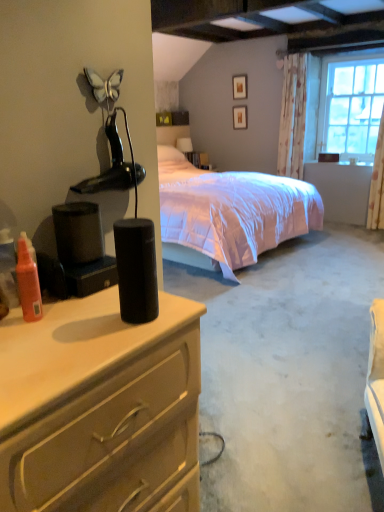
Question: Considering the relative positions of clear glass window at upper right and translucent orange spray bottle at left in the image provided, is clear glass window at upper right behind translucent orange spray bottle at left?

Choices:
 (A) yes
 (B) no

Answer: (A)

Question: Considering the relative sizes of clear glass window at upper right and translucent orange spray bottle at left in the image provided, is clear glass window at upper right taller than translucent orange spray bottle at left?

Choices:
 (A) yes
 (B) no

Answer: (A)

Question: Would you say clear glass window at upper right is outside translucent orange spray bottle at left?

Choices:
 (A) yes
 (B) no

Answer: (A)

Question: Is clear glass window at upper right to the left of translucent orange spray bottle at left from the viewer's perspective?

Choices:
 (A) no
 (B) yes

Answer: (A)

Question: Does clear glass window at upper right have a greater width compared to translucent orange spray bottle at left?

Choices:
 (A) yes
 (B) no

Answer: (A)

Question: Is matte black box at upper center wider or thinner than matte black speaker at left?

Choices:
 (A) thin
 (B) wide

Answer: (A)

Question: Relative to matte black speaker at left, is matte black box at upper center in front or behind?

Choices:
 (A) front
 (B) behind

Answer: (B)

Question: Is matte black box at upper center spatially inside matte black speaker at left, or outside of it?

Choices:
 (A) inside
 (B) outside

Answer: (B)

Question: From a real-world perspective, is matte black box at upper center above or below matte black speaker at left?

Choices:
 (A) below
 (B) above

Answer: (B)

Question: In the image, is matte wooden picture frame at upper center, the 2th picture frame ordered from the bottom, on the left side or the right side of black matte lamp at upper left?

Choices:
 (A) left
 (B) right

Answer: (B)

Question: Is matte wooden picture frame at upper center, the 2th picture frame ordered from the bottom, wider or thinner than black matte lamp at upper left?

Choices:
 (A) wide
 (B) thin

Answer: (B)

Question: From a real-world perspective, is matte wooden picture frame at upper center, the 2th picture frame ordered from the bottom, above or below black matte lamp at upper left?

Choices:
 (A) above
 (B) below

Answer: (A)

Question: From the image's perspective, is matte wooden picture frame at upper center, the 2th picture frame ordered from the bottom, located above or below black matte lamp at upper left?

Choices:
 (A) below
 (B) above

Answer: (B)

Question: Is white floral fabric curtain at upper right inside the boundaries of black matte speaker at center, or outside?

Choices:
 (A) inside
 (B) outside

Answer: (B)

Question: From a real-world perspective, is white floral fabric curtain at upper right above or below black matte speaker at center?

Choices:
 (A) below
 (B) above

Answer: (B)